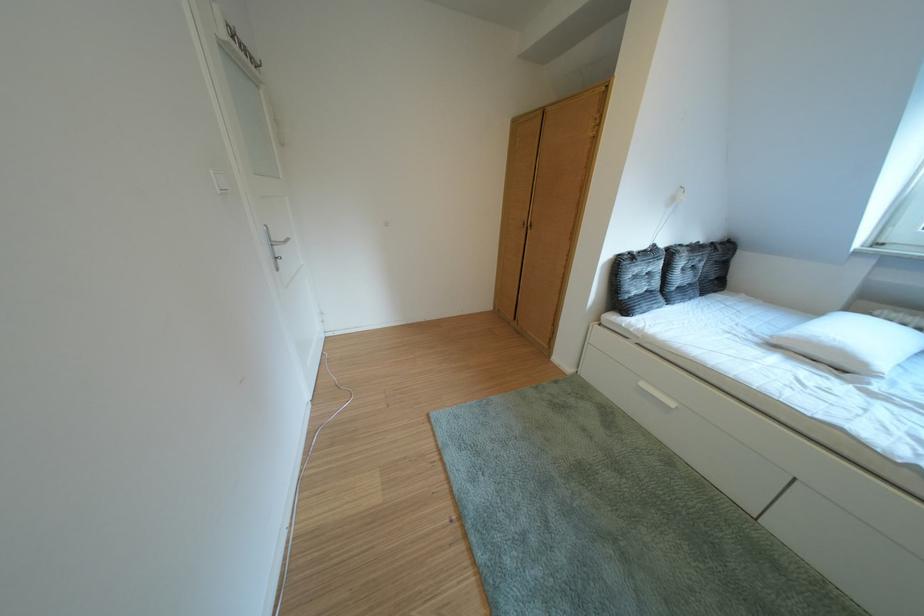
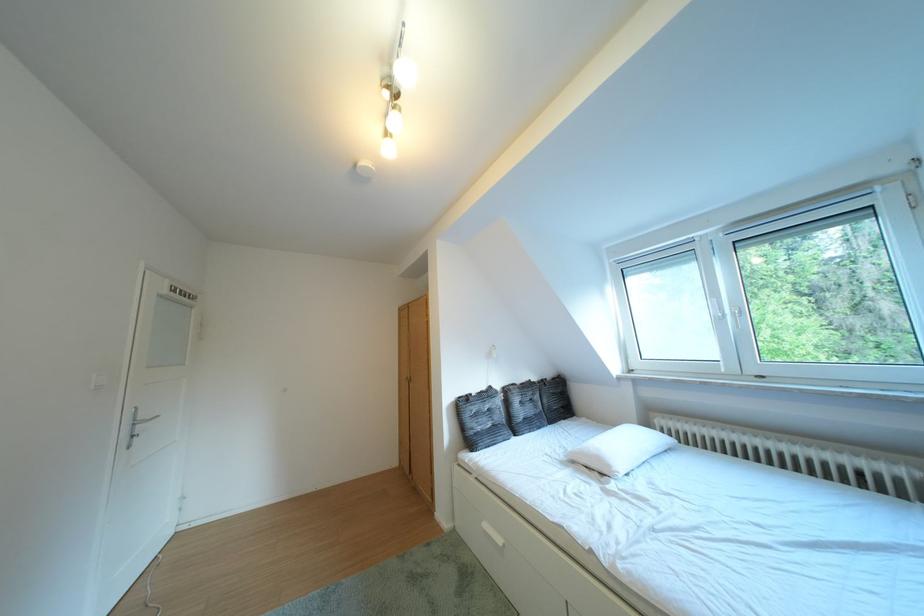
The point at (878, 369) is marked in the first image. Where is the corresponding point in the second image?

(623, 471)